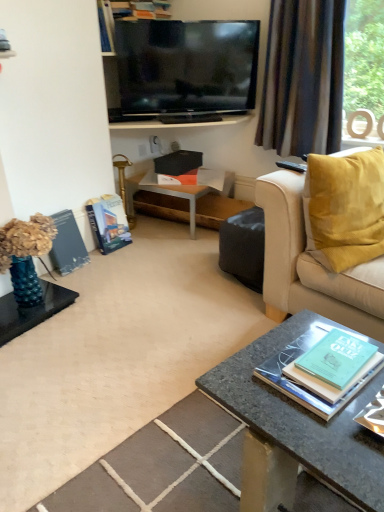
At what (x,y) coordinates should I click in order to perform the action: click on vacant space underneath flat-screen tv at upper center (from a real-world perspective). Please return your answer as a coordinate pair (x, y). Looking at the image, I should click on (185, 121).